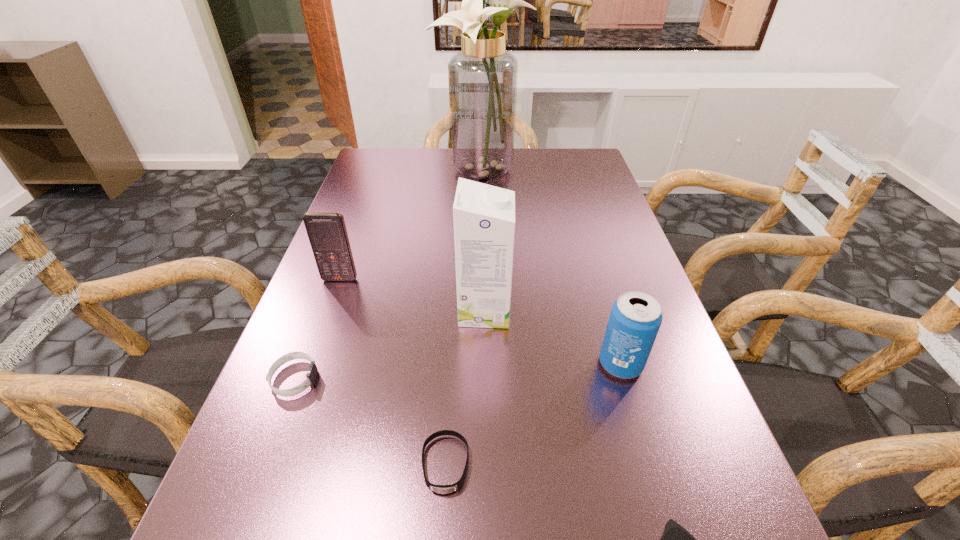
Where is `vacant region that satisfies the following two spatial constraints: 1. on the screen of the second farthest object; 2. on the right side of the carton`? vacant region that satisfies the following two spatial constraints: 1. on the screen of the second farthest object; 2. on the right side of the carton is located at coordinates (329, 310).

Where is `free region that satisfies the following two spatial constraints: 1. on the screen of the second tallest object; 2. on the right side of the sixth nearest object`? free region that satisfies the following two spatial constraints: 1. on the screen of the second tallest object; 2. on the right side of the sixth nearest object is located at coordinates (329, 310).

I want to click on free spot that satisfies the following two spatial constraints: 1. on the screen of the third farthest object; 2. on the right side of the cellular telephone, so click(x=329, y=310).